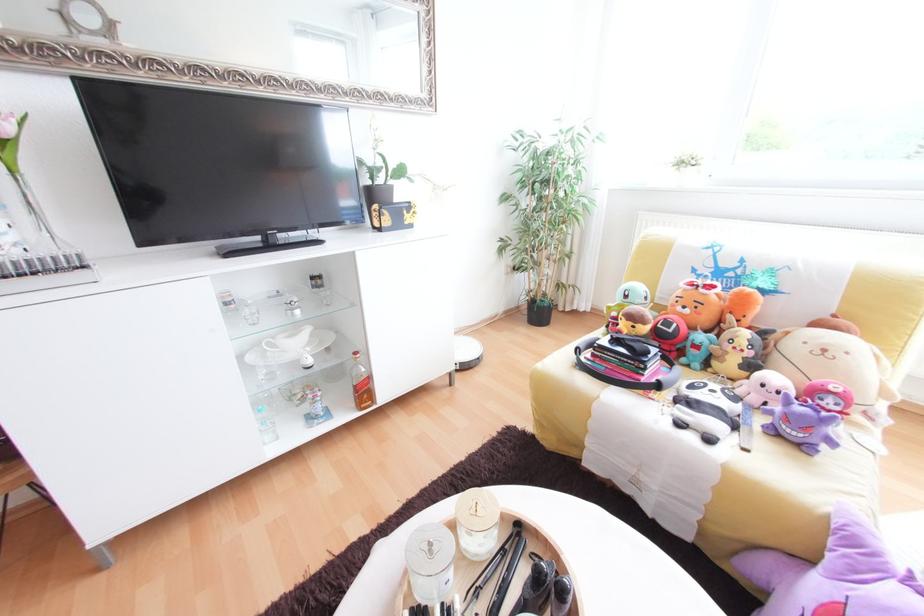
Find where to pull the white canister lid. Please return your answer as a coordinate pair (x, y).

(429, 546)